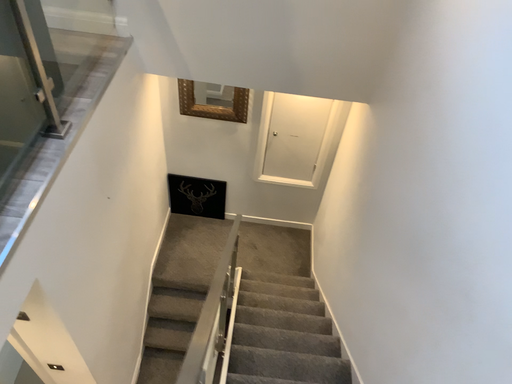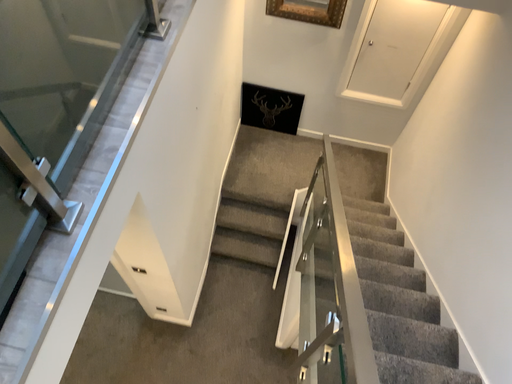
Question: Which way did the camera rotate in the video?

Choices:
 (A) rotated left
 (B) rotated right

Answer: (A)